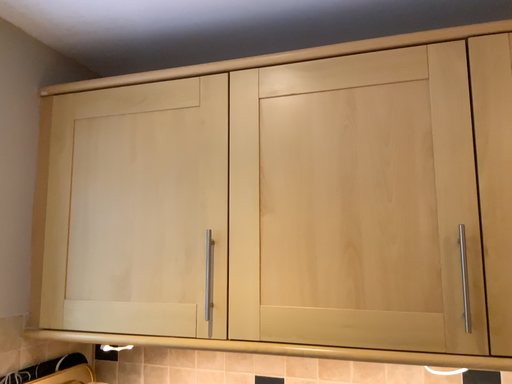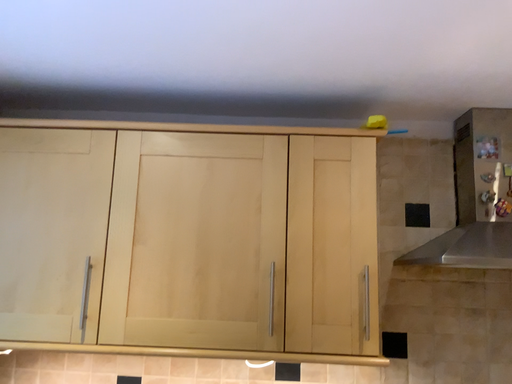
Question: How did the camera likely rotate when shooting the video?

Choices:
 (A) rotated right
 (B) rotated left

Answer: (A)